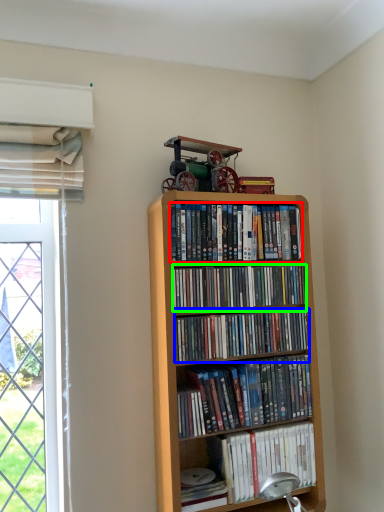
Question: Considering the real-world distances, which object is farthest from book (highlighted by a red box)? book (highlighted by a blue box) or book (highlighted by a green box)?

Choices:
 (A) book
 (B) book

Answer: (A)